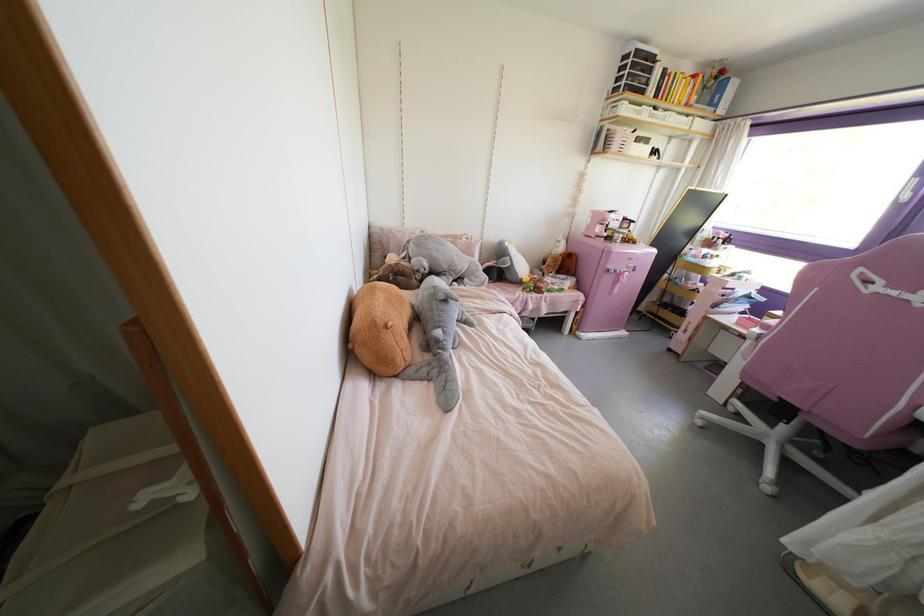
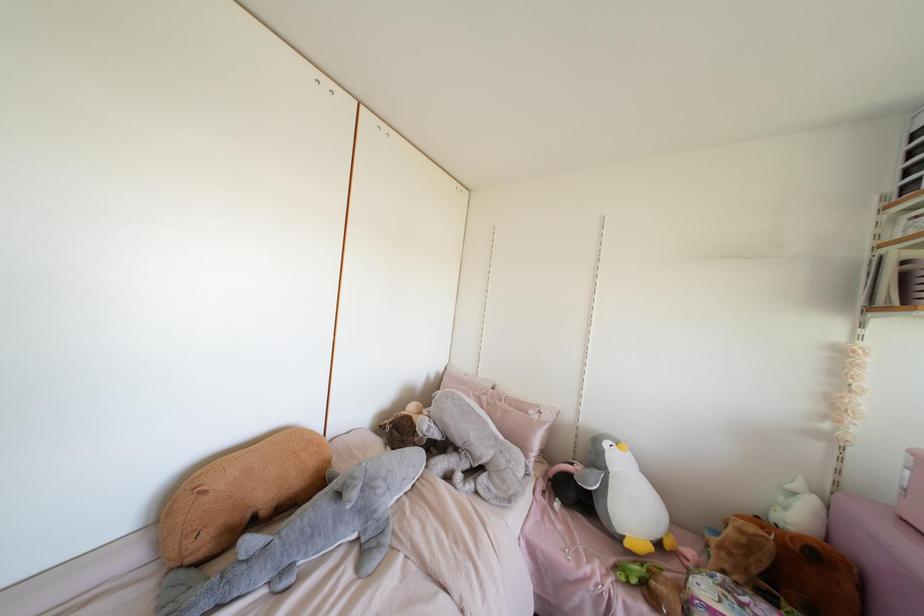
Locate, in the second image, the point that corresponds to point (553, 257) in the first image.

(739, 531)